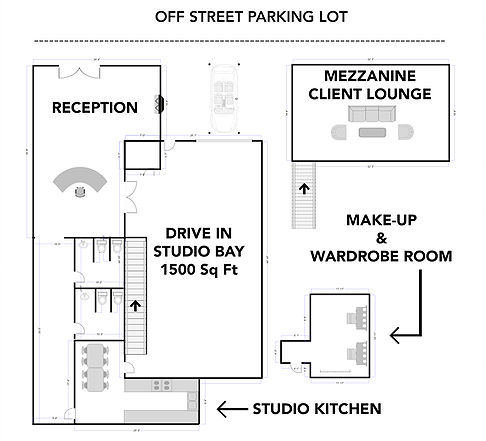
You are a GUI agent. You are given a task and a screenshot of the screen. Output one action in this format:
    pyautogui.click(x=<x>, y=<y>)
    Task: Click on the couch seats
    The width and height of the screenshot is (486, 441).
    Given the screenshot: What is the action you would take?
    pyautogui.click(x=362, y=116), pyautogui.click(x=371, y=115), pyautogui.click(x=385, y=115)